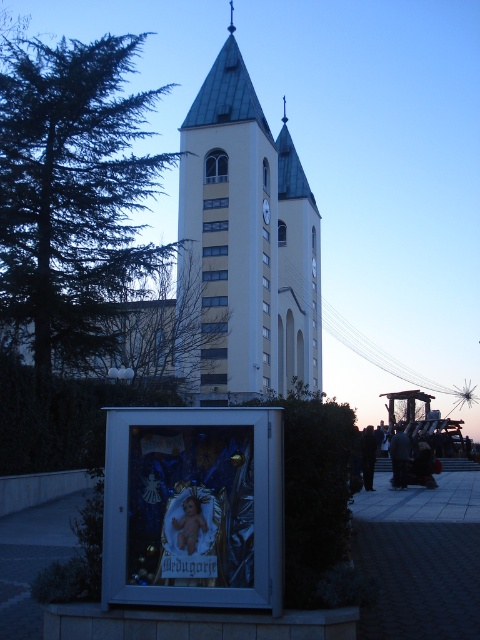
Question: Which point is farther to the camera?

Choices:
 (A) (203, 211)
 (B) (266, 218)

Answer: (B)

Question: Which object appears closest to the camera in this image?

Choices:
 (A) white glossy clock at center
 (B) yellow concrete tower at center

Answer: (B)

Question: Can you confirm if yellow concrete tower at center is positioned below white glossy clock at center?

Choices:
 (A) no
 (B) yes

Answer: (A)

Question: Does yellow concrete tower at center have a lesser width compared to white glossy clock at center?

Choices:
 (A) yes
 (B) no

Answer: (B)

Question: Can you confirm if yellow concrete tower at center is smaller than white glossy clock at center?

Choices:
 (A) no
 (B) yes

Answer: (A)